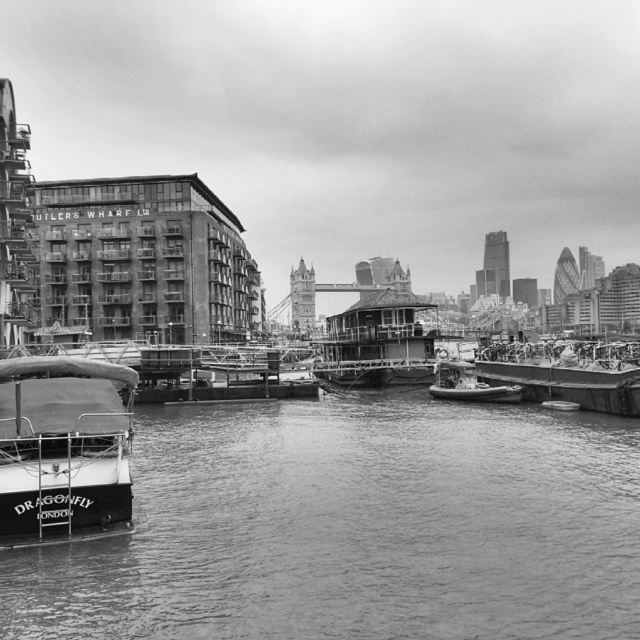
You are a photographer planning to capture the waterfront scene. You notice the smooth water at lower left and the white matte boat at lower left in your viewfinder. Based on their positions, which object would you adjust your camera to focus on if you want to emphasize the broader landscape rather than a specific detail?

The smooth water at lower left might be wider than the white matte boat at lower left, so focusing on the smooth water at lower left would better emphasize the broader landscape since it occupies more space in the scene.